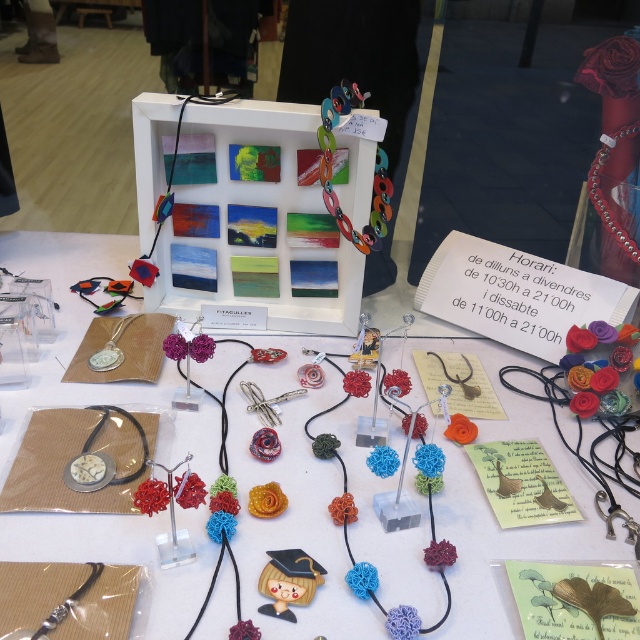
The height and width of the screenshot is (640, 640). What do you see at coordinates (492, 513) in the screenshot?
I see `white matte table at center` at bounding box center [492, 513].

Is point (129, 237) behind point (122, 413)?

Yes, it is.

Is point (68, 396) closer to camera compared to point (76, 460)?

That is False.

Identify the location of white matte table at center. (492, 513).

Who is taller, matte silver watch at center or leather beaded necklace at upper right?

leather beaded necklace at upper right is taller.

Describe the element at coordinates (100, 456) in the screenshot. I see `matte silver watch at center` at that location.

The width and height of the screenshot is (640, 640). In order to click on matte silver watch at center in this screenshot , I will do `click(100, 456)`.

Does point (106, 394) come in front of point (52, 624)?

No, it is not.

Does point (36, 384) come farther from viewer compared to point (38, 627)?

Yes.

The width and height of the screenshot is (640, 640). Identify the location of white matte table at center. (492, 513).